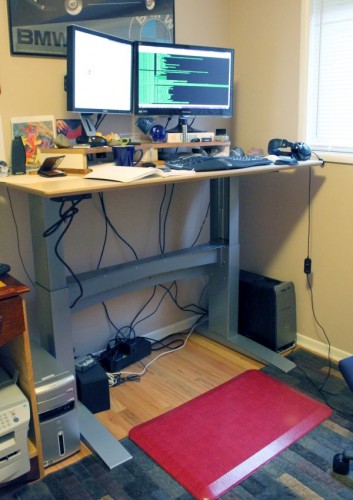
Locate an element on the screen. small wooden table is located at coordinates (6, 314).